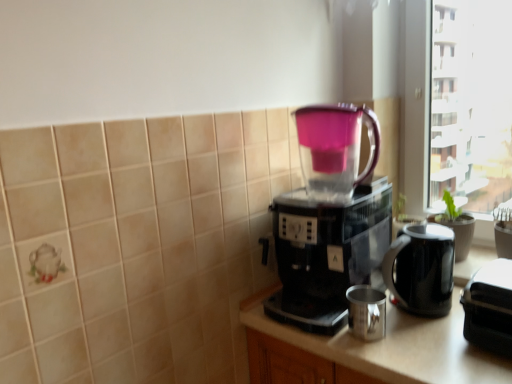
Question: In the image, is black glossy electric kettle at right positioned in front of or behind transparent plastic pitcher at center?

Choices:
 (A) behind
 (B) front

Answer: (A)

Question: In terms of height, does black glossy electric kettle at right look taller or shorter compared to transparent plastic pitcher at center?

Choices:
 (A) short
 (B) tall

Answer: (A)

Question: Which object is the farthest from the black plastic coffee maker at center?

Choices:
 (A) metallic silver cup at center
 (B) black glossy electric kettle at right
 (C) transparent plastic pitcher at center
 (D) metallic silver mug at lower center
 (E) black plastic toaster at right

Answer: (E)

Question: Estimate the real-world distances between objects in this image. Which object is closer to the metallic silver mug at lower center?

Choices:
 (A) black glossy electric kettle at right
 (B) transparent plastic pitcher at center
 (C) metallic silver cup at center
 (D) black plastic toaster at right
 (E) black plastic coffee maker at center

Answer: (C)